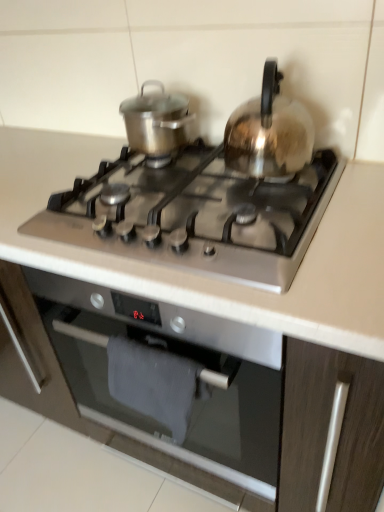
Question: Does satin silver gas stove at center have a lesser width compared to shiny metallic pot at upper left, the 2th kitchen appliance from the right?

Choices:
 (A) yes
 (B) no

Answer: (B)

Question: Is satin silver gas stove at center at the left side of shiny metallic pot at upper left, the 2th kitchen appliance from the right?

Choices:
 (A) no
 (B) yes

Answer: (A)

Question: Is satin silver gas stove at center facing away from shiny metallic pot at upper left, the 1th kitchen appliance viewed from the left?

Choices:
 (A) no
 (B) yes

Answer: (A)

Question: From the image's perspective, is satin silver gas stove at center located above shiny metallic pot at upper left, the 1th kitchen appliance viewed from the left?

Choices:
 (A) no
 (B) yes

Answer: (A)

Question: From a real-world perspective, is satin silver gas stove at center located higher than shiny metallic pot at upper left, the 2th kitchen appliance from the right?

Choices:
 (A) no
 (B) yes

Answer: (A)

Question: Is satin silver gas stove at center shorter than shiny metallic pot at upper left, the 2th kitchen appliance from the right?

Choices:
 (A) no
 (B) yes

Answer: (B)

Question: Can you confirm if satin silver gas stove at center is positioned to the right of satin silver kettle at upper right, the first kitchen appliance viewed from the right?

Choices:
 (A) yes
 (B) no

Answer: (B)

Question: Is satin silver gas stove at center smaller than satin silver kettle at upper right, positioned as the second kitchen appliance in left-to-right order?

Choices:
 (A) yes
 (B) no

Answer: (B)

Question: Is satin silver gas stove at center in front of satin silver kettle at upper right, positioned as the second kitchen appliance in left-to-right order?

Choices:
 (A) no
 (B) yes

Answer: (B)

Question: Is satin silver kettle at upper right, positioned as the second kitchen appliance in left-to-right order, at the back of satin silver gas stove at center?

Choices:
 (A) no
 (B) yes

Answer: (A)

Question: Is satin silver gas stove at center wider than satin silver kettle at upper right, the first kitchen appliance viewed from the right?

Choices:
 (A) yes
 (B) no

Answer: (A)

Question: Does satin silver gas stove at center have a lesser height compared to satin silver kettle at upper right, the first kitchen appliance viewed from the right?

Choices:
 (A) yes
 (B) no

Answer: (A)

Question: Can you confirm if satin silver oven at center is shorter than satin silver gas stove at center?

Choices:
 (A) no
 (B) yes

Answer: (A)